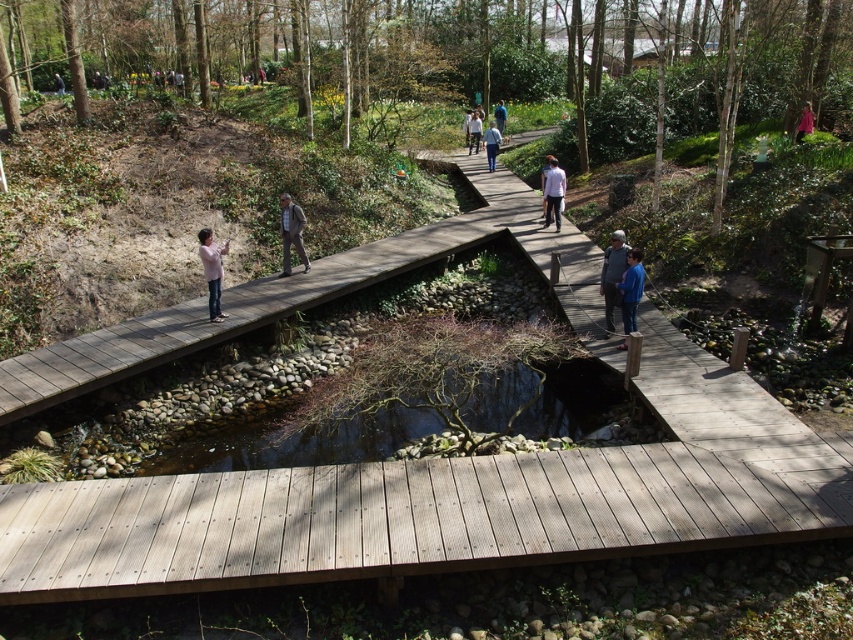
Is point (477, 400) positioned after point (201, 250)?

No, it is not.

Does clear water at center have a greater height compared to pink fabric at center?

No, clear water at center is not taller than pink fabric at center.

Does point (552, 397) lie in front of point (210, 288)?

Yes, point (552, 397) is closer to viewer.

This screenshot has height=640, width=853. Find the location of `clear water at center`. clear water at center is located at coordinates (294, 442).

Can you confirm if light brown suit at center is thinner than blue denim jacket at center?

Result: Indeed, light brown suit at center has a lesser width compared to blue denim jacket at center.

Does light brown suit at center have a lesser height compared to blue denim jacket at center?

Yes.

Is point (294, 234) in front of point (492, 138)?

Yes, point (294, 234) is closer to viewer.

Identify the location of light brown suit at center. This screenshot has height=640, width=853. 291,232.

Measure the distance from light brown suit at center to blue denim jeans at center.

A distance of 89.02 feet exists between light brown suit at center and blue denim jeans at center.

The image size is (853, 640). What do you see at coordinates (291, 232) in the screenshot?
I see `light brown suit at center` at bounding box center [291, 232].

Is point (294, 208) farther from viewer compared to point (62, 88)?

No, (294, 208) is closer to viewer.

Find the location of a particular element. The height and width of the screenshot is (640, 853). light brown suit at center is located at coordinates (291, 232).